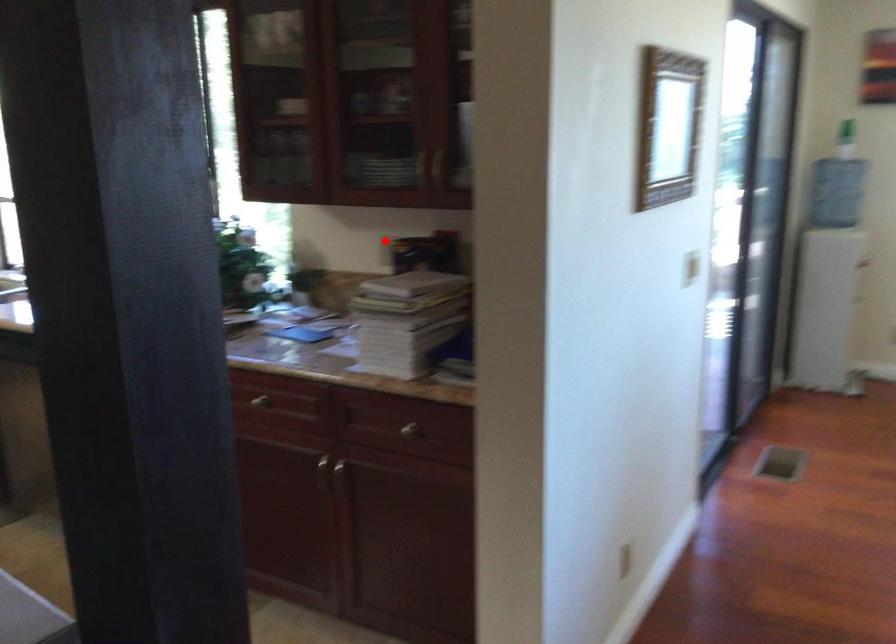
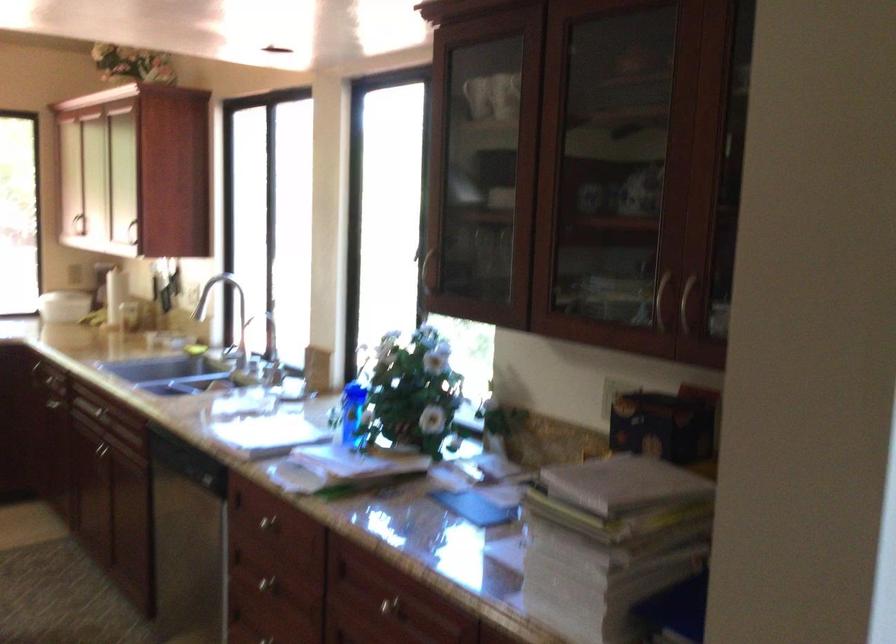
The point at the highlighted location is marked in the first image. Where is the corresponding point in the second image?

(614, 393)